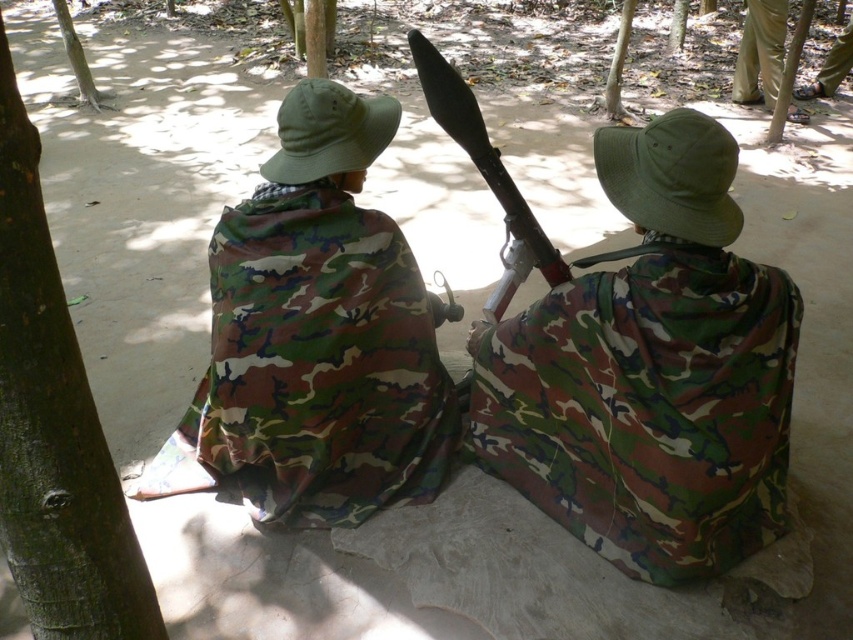
Question: Is green rough bark tree at left positioned before smooth brown tree trunk at upper center?

Choices:
 (A) yes
 (B) no

Answer: (A)

Question: Which point is farther from the camera taking this photo?

Choices:
 (A) (343, 486)
 (B) (78, 54)
 (C) (566, 268)
 (D) (91, 529)

Answer: (B)

Question: Does camouflage fabric rifle at center appear on the right side of matte black shotgun at center?

Choices:
 (A) yes
 (B) no

Answer: (A)

Question: Which of the following is the closest to the observer?

Choices:
 (A) (596, 365)
 (B) (560, 266)
 (C) (0, 204)

Answer: (C)

Question: Which of the following is the farthest from the observer?

Choices:
 (A) (434, 300)
 (B) (555, 330)

Answer: (A)

Question: Does camouflage fabric rifle at center have a greater width compared to smooth brown tree trunk at upper center?

Choices:
 (A) yes
 (B) no

Answer: (A)